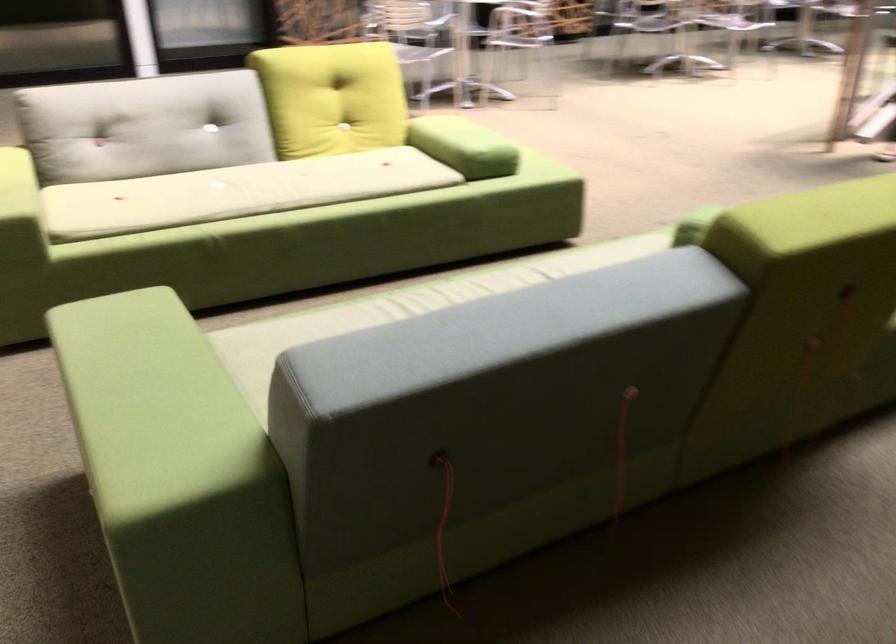
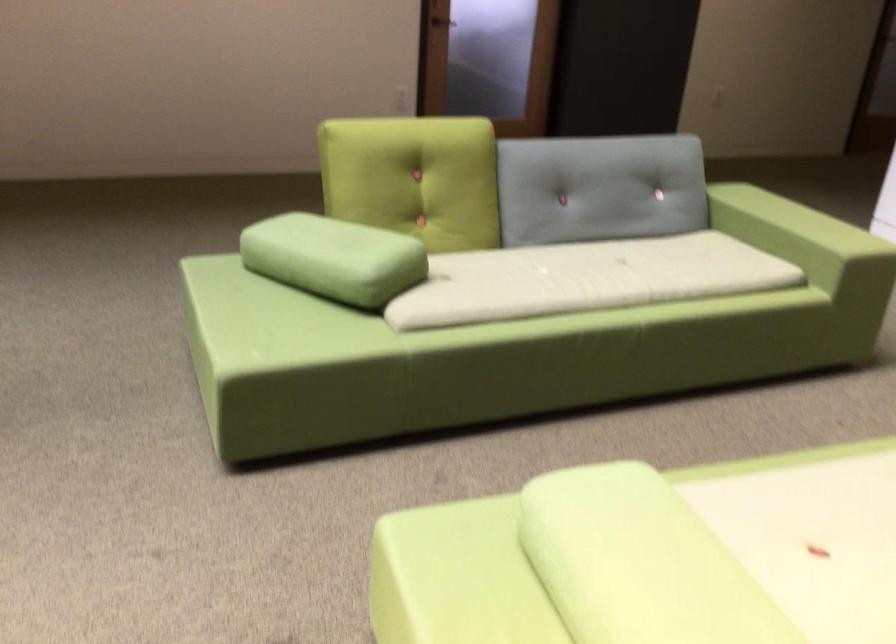
Locate, in the second image, the point that corresponds to point (470, 124) in the first image.

(639, 563)